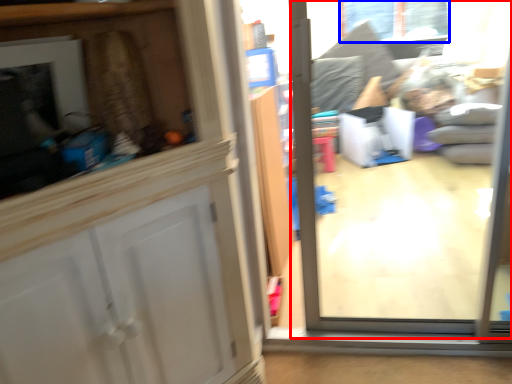
Question: Which of the following is the farthest to the observer, glass door (highlighted by a red box) or window (highlighted by a blue box)?

Choices:
 (A) glass door
 (B) window

Answer: (B)